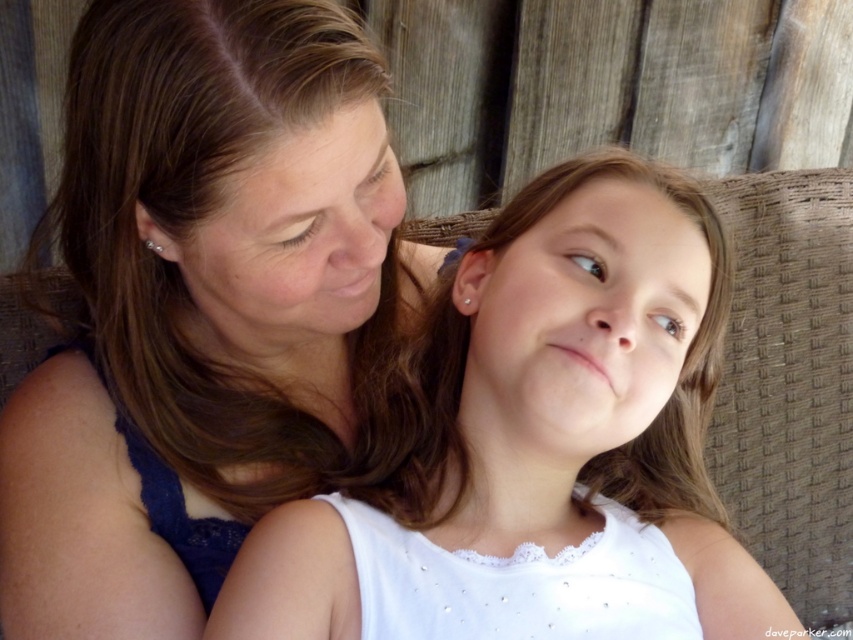
You are an artist planning to paint a scene similar to the one described. You have two pieces of fabric to choose from for the characters. The matte blue dress at upper left and the white fabric at center. Which fabric should you use if you want the larger one for the mother?

The matte blue dress at upper left is bigger than the white fabric at center, so you should choose the matte blue dress at upper left for the mother if you want the larger one.

You are an interior designer working on a layout for a small apartment. You have a sofa that is 1.8 meters wide and need to place it in the living room. The living room has a matte blue dress at upper left located at point 0.483, 0.239. Can you determine if the sofa will fit in the living room?

The position of the matte blue dress at upper left is at point (202, 308), but this information does not provide any spatial dimensions or measurements of the living room. Therefore, it is impossible to determine if the sofa will fit based solely on the location of the dress.